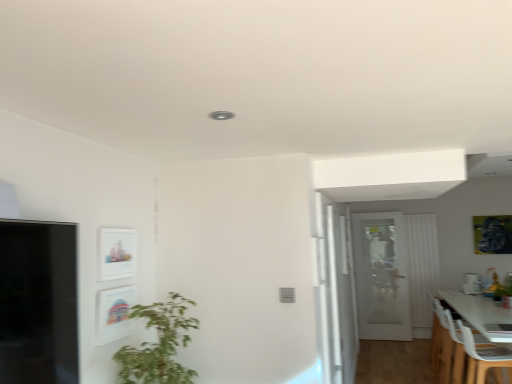
Question: Considering the relative sizes of metallic gold picture frame at upper right, which appears as the third picture frame when viewed from the left, and matte white picture frame at upper left, positioned as the 1th picture frame in left-to-right order, in the image provided, is metallic gold picture frame at upper right, which appears as the third picture frame when viewed from the left, bigger than matte white picture frame at upper left, positioned as the 1th picture frame in left-to-right order,?

Choices:
 (A) yes
 (B) no

Answer: (A)

Question: Can you confirm if metallic gold picture frame at upper right, marked as the first picture frame in a back-to-front arrangement, is taller than matte white picture frame at upper left, arranged as the second picture frame when viewed from the back?

Choices:
 (A) yes
 (B) no

Answer: (A)

Question: Is matte white picture frame at upper left, marked as the third picture frame in a right-to-left arrangement, surrounded by metallic gold picture frame at upper right, which is the 3th picture frame from front to back?

Choices:
 (A) yes
 (B) no

Answer: (B)

Question: Is metallic gold picture frame at upper right, marked as the first picture frame in a back-to-front arrangement, at the right side of matte white picture frame at upper left, positioned as the 1th picture frame in left-to-right order?

Choices:
 (A) yes
 (B) no

Answer: (A)

Question: From the image's perspective, is metallic gold picture frame at upper right, which appears as the third picture frame when viewed from the left, located beneath matte white picture frame at upper left, marked as the third picture frame in a right-to-left arrangement?

Choices:
 (A) no
 (B) yes

Answer: (B)

Question: From a real-world perspective, is metallic gold picture frame at upper right, which is the 3th picture frame from front to back, positioned under matte white picture frame at upper left, which is the second picture frame in front-to-back order, based on gravity?

Choices:
 (A) yes
 (B) no

Answer: (B)

Question: From the image's perspective, does white plastic chair at lower right, the second chair in the front-to-back sequence, appear lower than white plastic chair at lower right, which is the 1th chair in front-to-back order?

Choices:
 (A) no
 (B) yes

Answer: (B)

Question: Is white plastic chair at lower right, acting as the first chair starting from the back, looking in the opposite direction of white plastic chair at lower right, which is the 1th chair in front-to-back order?

Choices:
 (A) no
 (B) yes

Answer: (A)

Question: Is white plastic chair at lower right, acting as the first chair starting from the back, positioned in front of white plastic chair at lower right, marked as the second chair in a back-to-front arrangement?

Choices:
 (A) yes
 (B) no

Answer: (B)

Question: Is white plastic chair at lower right, the second chair in the front-to-back sequence, shorter than white plastic chair at lower right, marked as the second chair in a back-to-front arrangement?

Choices:
 (A) yes
 (B) no

Answer: (B)

Question: Is white plastic chair at lower right, acting as the first chair starting from the back, oriented towards white plastic chair at lower right, which is the 1th chair in front-to-back order?

Choices:
 (A) no
 (B) yes

Answer: (A)

Question: From a real-world perspective, is white plastic chair at lower right, acting as the first chair starting from the back, located beneath white plastic chair at lower right, which is the 1th chair in front-to-back order?

Choices:
 (A) no
 (B) yes

Answer: (B)

Question: Is white fabric curtain at right shorter than green leafy plant at lower right?

Choices:
 (A) no
 (B) yes

Answer: (A)